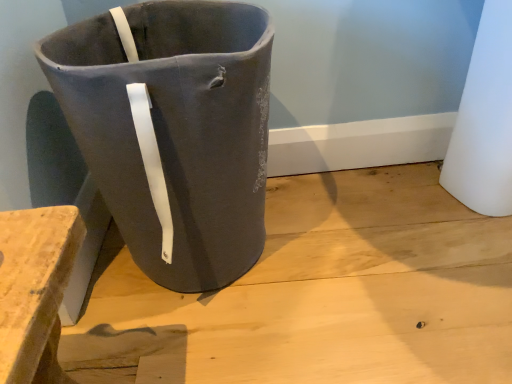
Question: Is point (211, 238) positioned closer to the camera than point (376, 319)?

Choices:
 (A) closer
 (B) farther

Answer: (A)

Question: Considering the relative positions of matte gray fabric bag at center and matte gray concrete at center in the image provided, is matte gray fabric bag at center to the left or to the right of matte gray concrete at center?

Choices:
 (A) left
 (B) right

Answer: (A)

Question: Which is correct: matte gray fabric bag at center is inside matte gray concrete at center, or outside of it?

Choices:
 (A) outside
 (B) inside

Answer: (A)

Question: From the image's perspective, is matte gray concrete at center above or below matte gray fabric bag at center?

Choices:
 (A) below
 (B) above

Answer: (A)

Question: Considering the positions of point (172, 370) and point (148, 230), is point (172, 370) closer or farther from the camera than point (148, 230)?

Choices:
 (A) farther
 (B) closer

Answer: (B)

Question: Looking at their shapes, would you say matte gray concrete at center is wider or thinner than matte gray fabric bag at center?

Choices:
 (A) thin
 (B) wide

Answer: (B)

Question: Is matte gray concrete at center in front of or behind matte gray fabric bag at center in the image?

Choices:
 (A) front
 (B) behind

Answer: (B)